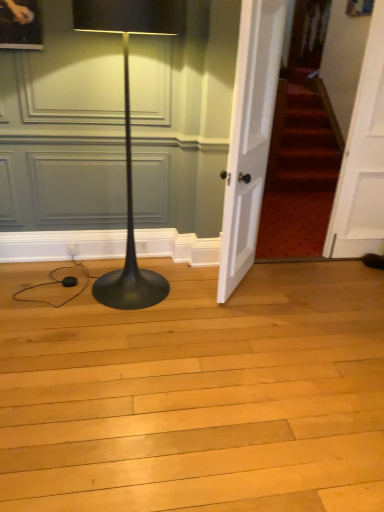
Where is `vacant area that is situated to the right of white wooden door at center, the first door in the left-to-right sequence`? vacant area that is situated to the right of white wooden door at center, the first door in the left-to-right sequence is located at coordinates (284, 292).